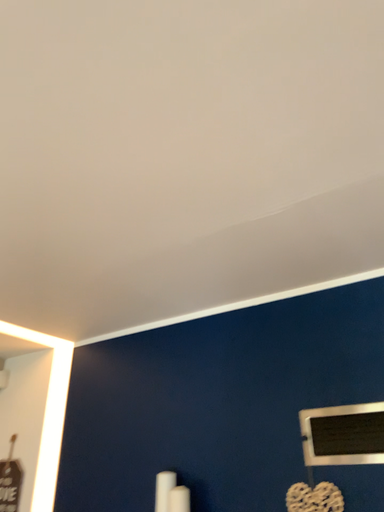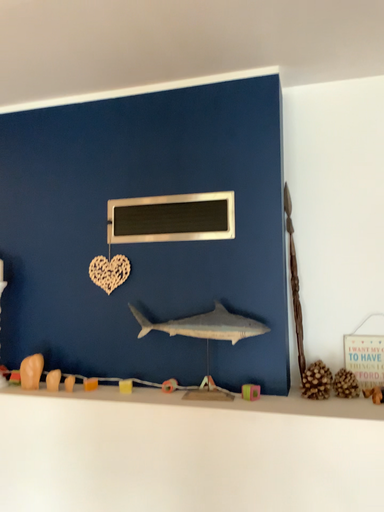
Question: How did the camera likely rotate when shooting the video?

Choices:
 (A) rotated upward
 (B) rotated downward

Answer: (B)